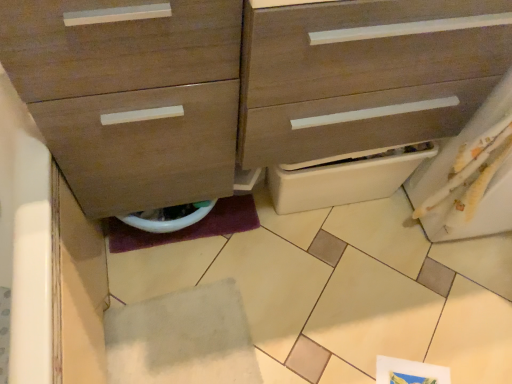
Question: From a real-world perspective, is white felt tile at lower center physically above white glossy toilet bowl at lower center?

Choices:
 (A) yes
 (B) no

Answer: (B)

Question: Is white glossy toilet bowl at lower center completely or partially inside white felt tile at lower center?

Choices:
 (A) no
 (B) yes

Answer: (A)

Question: Does white felt tile at lower center have a lesser height compared to white glossy toilet bowl at lower center?

Choices:
 (A) no
 (B) yes

Answer: (B)

Question: From the image's perspective, is white felt tile at lower center below white glossy toilet bowl at lower center?

Choices:
 (A) no
 (B) yes

Answer: (B)

Question: Are white felt tile at lower center and white glossy toilet bowl at lower center making contact?

Choices:
 (A) no
 (B) yes

Answer: (A)

Question: Does white felt tile at lower center have a greater width compared to white glossy toilet bowl at lower center?

Choices:
 (A) no
 (B) yes

Answer: (B)

Question: Considering the relative positions of matte wood chest of drawers at center and white felt tile at lower center in the image provided, is matte wood chest of drawers at center behind white felt tile at lower center?

Choices:
 (A) yes
 (B) no

Answer: (B)

Question: Is matte wood chest of drawers at center in contact with white felt tile at lower center?

Choices:
 (A) yes
 (B) no

Answer: (B)

Question: Can you confirm if matte wood chest of drawers at center is positioned to the right of white felt tile at lower center?

Choices:
 (A) no
 (B) yes

Answer: (B)

Question: Could white felt tile at lower center be considered to be inside matte wood chest of drawers at center?

Choices:
 (A) yes
 (B) no

Answer: (B)

Question: Does matte wood chest of drawers at center have a larger size compared to white felt tile at lower center?

Choices:
 (A) yes
 (B) no

Answer: (A)

Question: Is matte wood chest of drawers at center shorter than white felt tile at lower center?

Choices:
 (A) no
 (B) yes

Answer: (A)

Question: Does white felt tile at lower center turn towards matte wood chest of drawers at center?

Choices:
 (A) no
 (B) yes

Answer: (A)